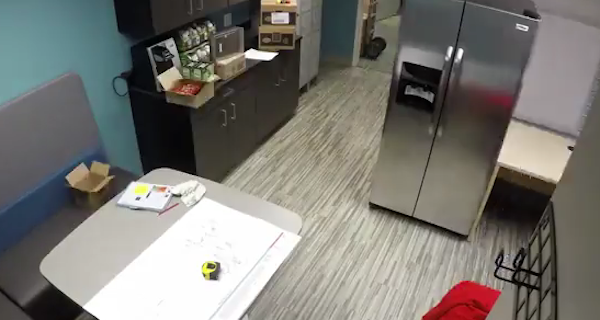
I want to click on opened cardboard box, so click(203, 89), click(96, 182).